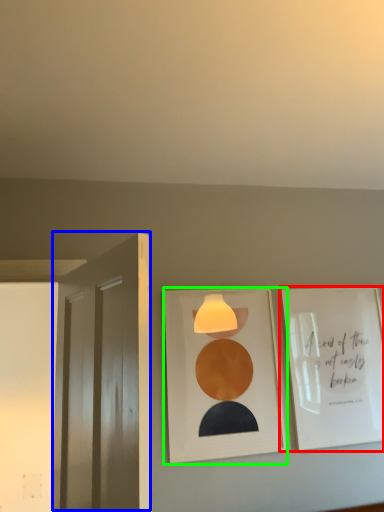
Question: Which is nearer to the picture frame (highlighted by a red box)? door (highlighted by a blue box) or picture frame (highlighted by a green box).

Choices:
 (A) door
 (B) picture frame

Answer: (B)